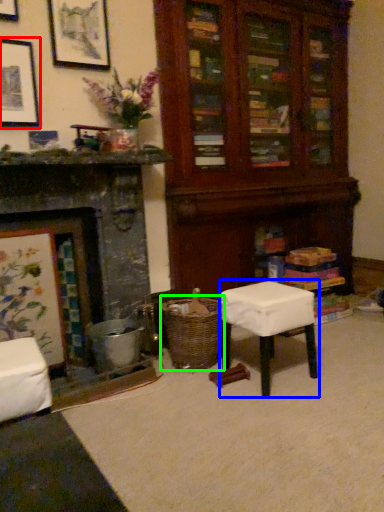
Question: Which object is the farthest from picture frame (highlighted by a red box)? Choose among these: stool (highlighted by a blue box) or crate (highlighted by a green box).

Choices:
 (A) stool
 (B) crate

Answer: (A)